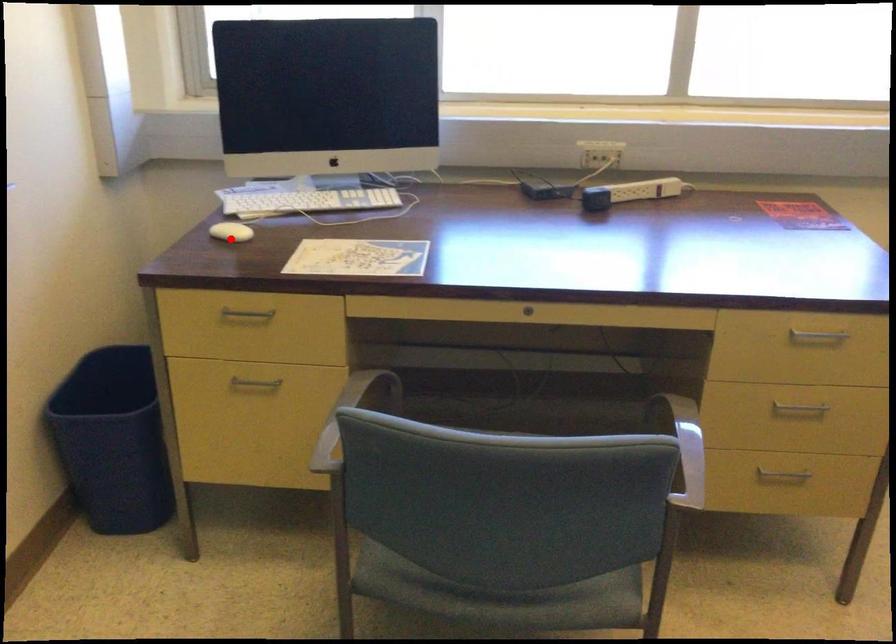
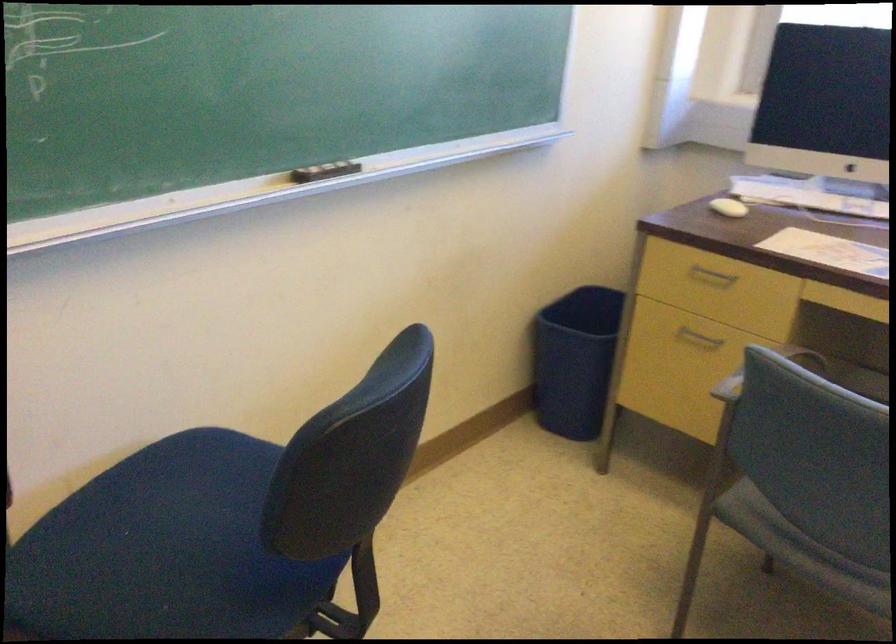
In the second image, find the point that corresponds to the highlighted location in the first image.

(728, 207)